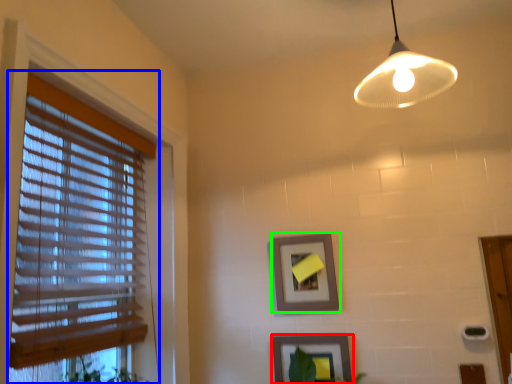
Question: Estimate the real-world distances between objects in this image. Which object is farther from picture frame (highlighted by a red box), window blind (highlighted by a blue box) or picture frame (highlighted by a green box)?

Choices:
 (A) window blind
 (B) picture frame

Answer: (A)